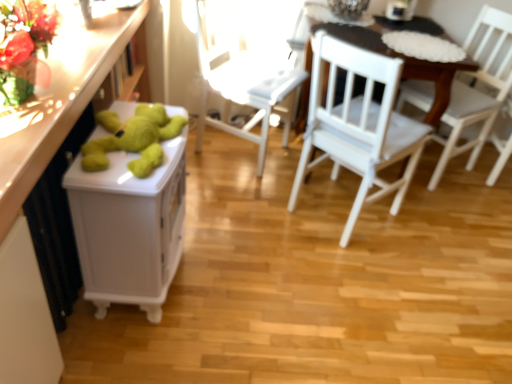
Question: Would you say green plush bear at left is to the left or to the right of white wood chair at center, which is the 2th chair from right to left, in the picture?

Choices:
 (A) left
 (B) right

Answer: (A)

Question: In terms of size, does green plush bear at left appear bigger or smaller than white wood chair at center, the second chair from the left?

Choices:
 (A) big
 (B) small

Answer: (B)

Question: Which is nearer to the green plush bear at left?

Choices:
 (A) green plush toy at left
 (B) green plush bear at left
 (C) white wood chair at center, the second chair from the left
 (D) white wood chair at center, the first chair positioned from the left
 (E) white wooden table at center

Answer: (B)

Question: Estimate the real-world distances between objects in this image. Which object is farther from the white wood chair at right, which is counted as the first chair, starting from the right?

Choices:
 (A) white wood chair at center, which is the 2th chair from right to left
 (B) green plush bear at left
 (C) white wood chair at center, the first chair positioned from the left
 (D) green plush toy at left
 (E) white wooden table at center

Answer: (D)